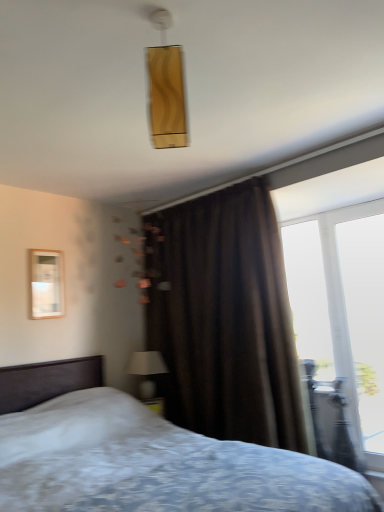
Based on the photo, measure the distance between point (51, 288) and camera.

A distance of 10.67 feet exists between point (51, 288) and camera.

What do you see at coordinates (224, 318) in the screenshot? I see `brown velvet curtain at center` at bounding box center [224, 318].

Describe the element at coordinates (365, 318) in the screenshot. Image resolution: width=384 pixels, height=512 pixels. I see `transparent glass window at right` at that location.

What is the approximate height of transparent glass window at right?

The height of transparent glass window at right is 6.88 feet.

Find the location of a particular element. The image size is (384, 512). matte white lampshade at lower center is located at coordinates (147, 371).

The height and width of the screenshot is (512, 384). I want to click on metallic silver armchair at right, so click(x=333, y=422).

Which of these two, matte white lampshade at lower center or wooden frame at left, is wider?

With larger width is matte white lampshade at lower center.

From the image's perspective, relative to wooden frame at left, is matte white lampshade at lower center above or below?

matte white lampshade at lower center is situated lower than wooden frame at left in the image.

How many degrees apart are the facing directions of matte white lampshade at lower center and wooden frame at left?

1.08 degrees.

Is point (139, 387) farther from camera compared to point (55, 265)?

Yes.

Looking at this image, which object is positioned more to the right, wooden frame at left or transparent glass window at right?

Positioned to the right is transparent glass window at right.

From a real-world perspective, is wooden frame at left positioned above or below transparent glass window at right?

wooden frame at left is situated higher than transparent glass window at right in the real world.

Looking at their sizes, would you say wooden frame at left is wider or thinner than transparent glass window at right?

Clearly, wooden frame at left has less width compared to transparent glass window at right.

From the image's perspective, is matte white lampshade at lower center beneath metallic silver armchair at right?

No, from the image's perspective, matte white lampshade at lower center is not beneath metallic silver armchair at right.

Considering the relative sizes of matte white lampshade at lower center and metallic silver armchair at right in the image provided, is matte white lampshade at lower center bigger than metallic silver armchair at right?

No.

At what (x,y) coordinates should I click in order to perform the action: click on table lamp behind the metallic silver armchair at right. Please return your answer as a coordinate pair (x, y). Looking at the image, I should click on (147, 371).

Locate an element on the screen. Image resolution: width=384 pixels, height=512 pixels. table lamp on the left of transparent glass window at right is located at coordinates (147, 371).

Which is behind, point (307, 302) or point (143, 379)?

The point (307, 302) is more distant.

Does transparent glass window at right appear on the right side of matte white lampshade at lower center?

Yes, transparent glass window at right is to the right of matte white lampshade at lower center.

Is matte white lampshade at lower center surrounded by transparent glass window at right?

No, matte white lampshade at lower center is not surrounded by transparent glass window at right.

Is point (364, 463) less distant than point (152, 368)?

Yes, it is in front of point (152, 368).

Considering the relative positions of metallic silver armchair at right and matte white lampshade at lower center in the image provided, is metallic silver armchair at right in front of matte white lampshade at lower center?

Yes, metallic silver armchair at right is closer to the camera.

Considering the sizes of objects metallic silver armchair at right and matte white lampshade at lower center in the image provided, who is bigger, metallic silver armchair at right or matte white lampshade at lower center?

metallic silver armchair at right is bigger.

Would you say metallic silver armchair at right is inside or outside matte white lampshade at lower center?

metallic silver armchair at right cannot be found inside matte white lampshade at lower center.

The width and height of the screenshot is (384, 512). I want to click on curtain that is on the right side of wooden frame at left, so click(224, 318).

From a real-world perspective, which object stands above the other?

In real-world perspective, wooden frame at left is above.

Looking at this image, which is behind, brown velvet curtain at center or wooden frame at left?

wooden frame at left is further from the camera.

Is brown velvet curtain at center bigger or smaller than wooden frame at left?

In the image, brown velvet curtain at center appears to be larger than wooden frame at left.

In the scene shown: Is transparent glass window at right aimed at matte white lampshade at lower center?

No, transparent glass window at right is not facing towards matte white lampshade at lower center.

Looking at their sizes, would you say transparent glass window at right is wider or thinner than matte white lampshade at lower center?

transparent glass window at right is thinner than matte white lampshade at lower center.

From a real-world perspective, does transparent glass window at right stand above matte white lampshade at lower center?

Correct, in the physical world, transparent glass window at right is higher than matte white lampshade at lower center.

What are the coordinates of `picture frame on the left of matte white lampshade at lower center` in the screenshot? It's located at (47, 284).

At what (x,y) coordinates should I click in order to perform the action: click on window below the wooden frame at left (from the image's perspective). Please return your answer as a coordinate pair (x, y). The height and width of the screenshot is (512, 384). Looking at the image, I should click on (365, 318).

Looking at the image, which one is located further to transparent glass window at right, white textured bed at center or metallic silver armchair at right?

white textured bed at center.

Considering their positions, is white textured bed at center positioned closer to metallic silver armchair at right than gold textured rectangular light fixture at upper center?

Based on the image, white textured bed at center appears to be nearer to metallic silver armchair at right.

Based on their spatial positions, is white textured bed at center or gold textured rectangular light fixture at upper center further from transparent glass window at right?

gold textured rectangular light fixture at upper center lies further to transparent glass window at right than the other object.

Looking at the image, which one is located further to gold textured rectangular light fixture at upper center, transparent glass window at right or metallic silver armchair at right?

The object further to gold textured rectangular light fixture at upper center is metallic silver armchair at right.

Considering their positions, is white textured bed at center positioned further to matte white lampshade at lower center than gold textured rectangular light fixture at upper center?

The object further to matte white lampshade at lower center is gold textured rectangular light fixture at upper center.

Considering their positions, is matte white lampshade at lower center positioned closer to wooden frame at left than gold textured rectangular light fixture at upper center?

matte white lampshade at lower center is closer to wooden frame at left.

Considering their positions, is transparent glass window at right positioned further to matte white lampshade at lower center than transparent glass window at right?

transparent glass window at right lies further to matte white lampshade at lower center than the other object.

Which object lies further to the anchor point gold textured rectangular light fixture at upper center, transparent glass window at right or matte white lampshade at lower center?

matte white lampshade at lower center is further to gold textured rectangular light fixture at upper center.

At what (x,y) coordinates should I click in order to perform the action: click on curtain between matte white lampshade at lower center and transparent glass window at right from left to right. Please return your answer as a coordinate pair (x, y). Image resolution: width=384 pixels, height=512 pixels. Looking at the image, I should click on (224, 318).

This screenshot has width=384, height=512. I want to click on curtain between white textured bed at center and transparent glass window at right along the z-axis, so click(x=224, y=318).

You are a GUI agent. You are given a task and a screenshot of the screen. Output one action in this format:
    pyautogui.click(x=<x>, y=<y>)
    Task: Click on the curtain between white textured bed at center and matte white lampshade at lower center along the z-axis
    
    Given the screenshot: What is the action you would take?
    pyautogui.click(x=224, y=318)

Locate an element on the screen. window screen between matte white lampshade at lower center and metallic silver armchair at right in the horizontal direction is located at coordinates (308, 296).